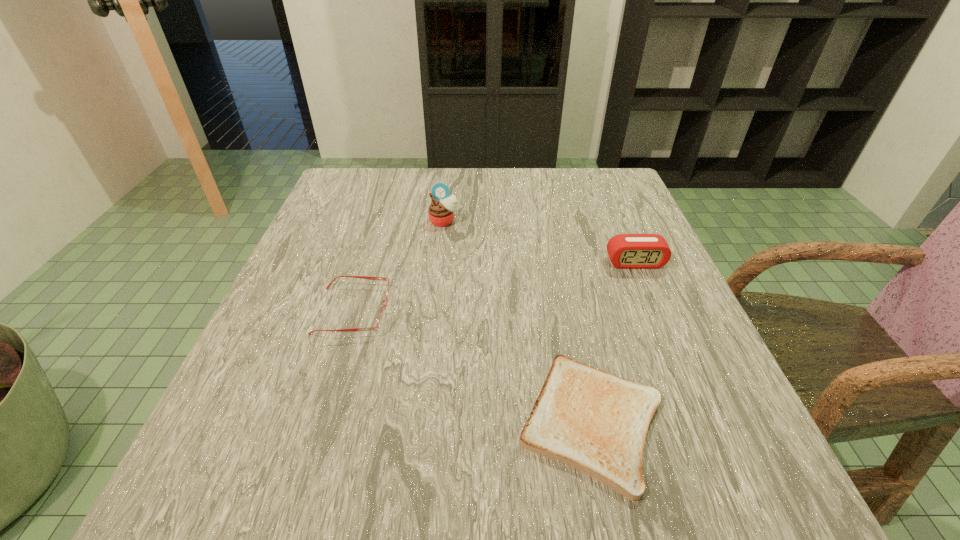
At what (x,y) coordinates should I click in order to perform the action: click on blank space at the left edge of the desktop. Please return your answer as a coordinate pair (x, y). The height and width of the screenshot is (540, 960). Looking at the image, I should click on (254, 445).

At what (x,y) coordinates should I click in order to perform the action: click on free region at the right edge of the desktop. Please return your answer as a coordinate pair (x, y). Looking at the image, I should click on (698, 386).

In the image, there is a desktop. Where is `free space at the far left corner`? Image resolution: width=960 pixels, height=540 pixels. free space at the far left corner is located at coordinates (371, 196).

In the image, there is a desktop. Where is `vacant space at the near left corner`? The width and height of the screenshot is (960, 540). vacant space at the near left corner is located at coordinates (284, 464).

Image resolution: width=960 pixels, height=540 pixels. In the image, there is a desktop. Find the location of `free space at the far right corner`. free space at the far right corner is located at coordinates (566, 187).

Find the location of a particular element. The height and width of the screenshot is (540, 960). free space between the tallest object and the second tallest object is located at coordinates (540, 242).

Identify the location of vacant space that is in between the leftmost object and the shortest object. (472, 366).

Image resolution: width=960 pixels, height=540 pixels. I want to click on unoccupied area between the toast and the farthest object, so click(517, 321).

The image size is (960, 540). What are the coordinates of `empty location between the spectacles and the third shortest object` in the screenshot? It's located at (494, 287).

Identify the location of vacant space that is in between the farthest object and the third tallest object. (x=398, y=266).